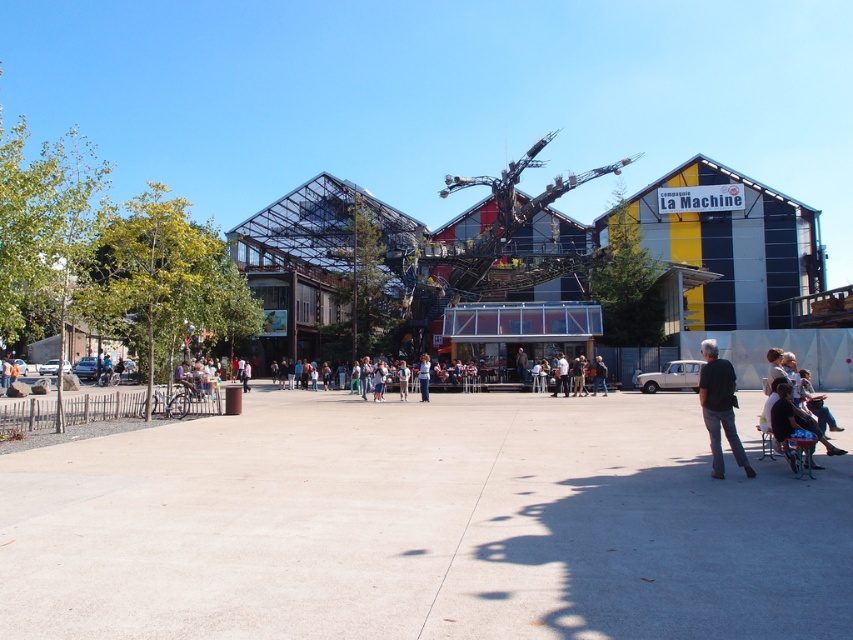
You are an event organizer planning an outdoor gathering at this location. You need to place a large banner between the black fabric pants at lower right and the white fabric shirt at center. Based on their sizes, which object should the banner be closer to?

The banner should be closer to the white fabric shirt at center because the black fabric pants at lower right has a smaller size compared to the white fabric shirt at center, making the shirt a better anchor point for the banner placement.

You are a photographer trying to capture a photo of the building with the green plastic baby carriage at lower right and the white fabric shirt at center in the foreground. To ensure both are in focus, you need to know which object is closer to the camera. Can you determine which one is closer?

The green plastic baby carriage at lower right is shorter than the white fabric shirt at center, so the white fabric shirt at center is closer to the camera.

You are standing in front of the building and want to take a photo that includes both the sign reading La Machine and the people gathered in the paved area. Which of the two points, point (724, 429) or point (426, 394), should you focus on to ensure both elements are in clear view?

You should focus on point (724, 429) because it is closer to the camera than point (426, 394), allowing for better visibility of both the sign and the people.